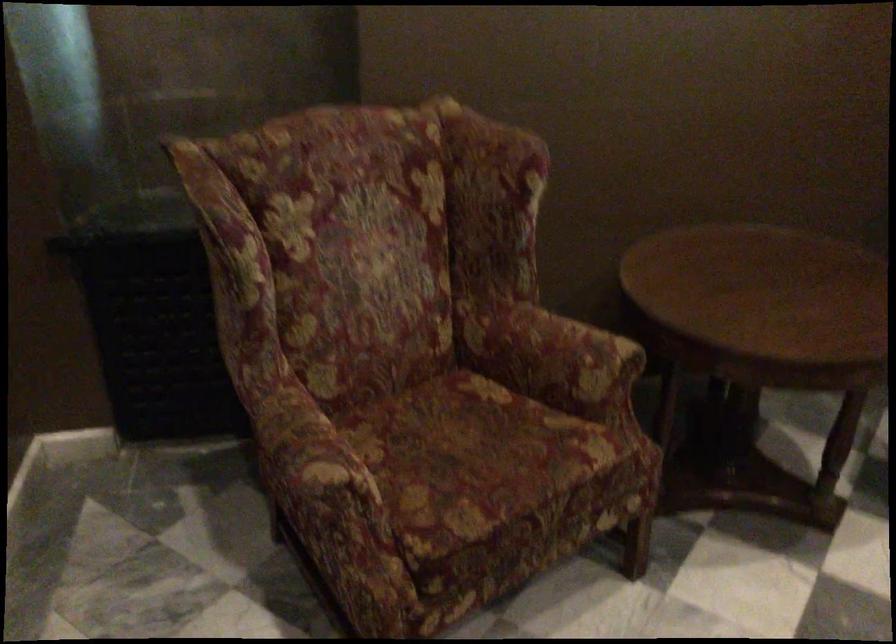
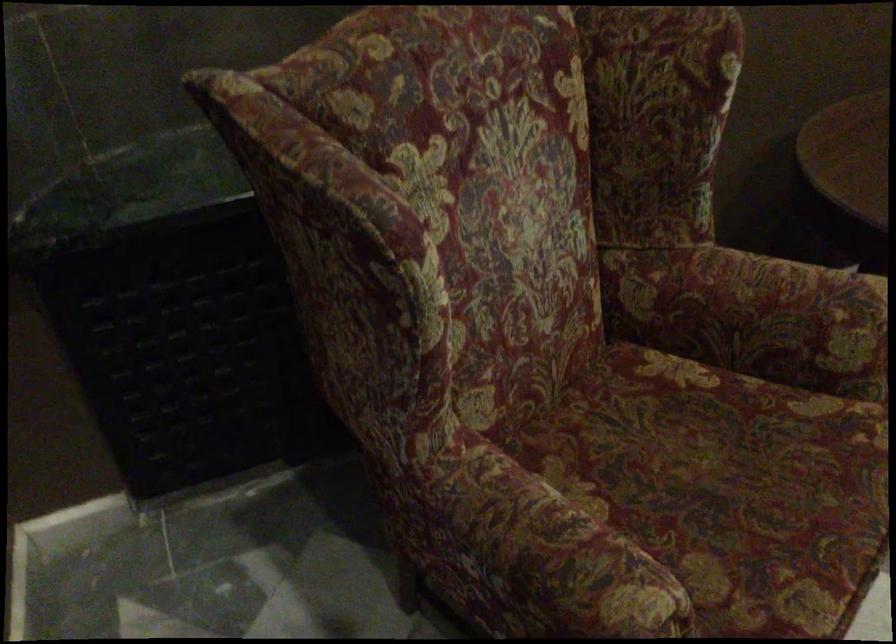
The point at (x=290, y=446) is marked in the first image. Where is the corresponding point in the second image?

(543, 559)